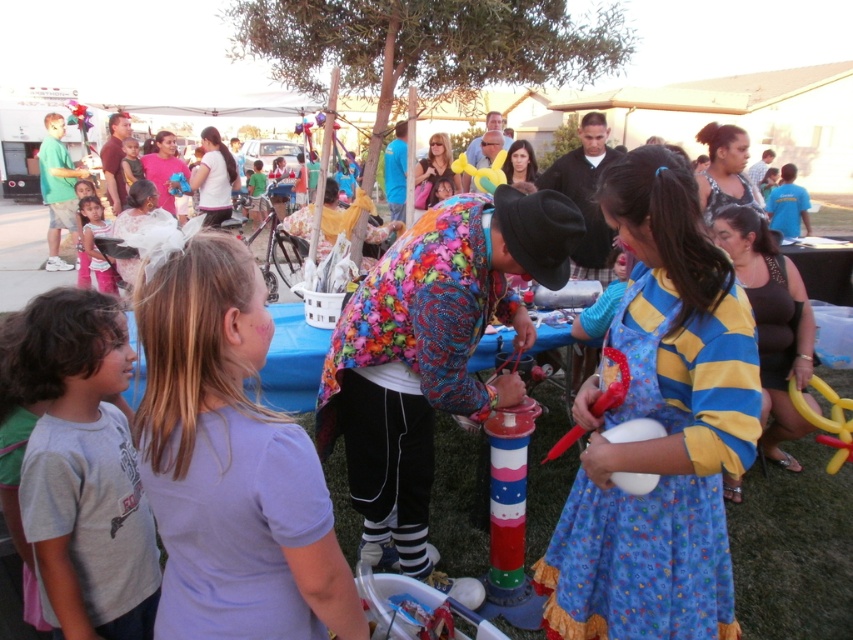
Does white matte balloon at lower center appear on the right side of matte pink dress at lower left?

Indeed, white matte balloon at lower center is positioned on the right side of matte pink dress at lower left.

How far apart are white matte balloon at lower center and matte pink dress at lower left?

white matte balloon at lower center is 5.60 meters from matte pink dress at lower left.

This screenshot has height=640, width=853. Find the location of `white matte balloon at lower center`. white matte balloon at lower center is located at coordinates (634, 429).

Is point (770, 371) positioned in front of point (451, 163)?

Yes.

Who is taller, black jersey dress at center or yellow balloon at center?

Standing taller between the two is yellow balloon at center.

Is point (759, 296) more distant than point (453, 170)?

No, it is not.

I want to click on black jersey dress at center, so click(775, 323).

Between yellow rubber balloon animal at lower right and white matte balloon at lower center, which one appears on the left side from the viewer's perspective?

white matte balloon at lower center

Does yellow rubber balloon animal at lower right lie in front of white matte balloon at lower center?

No, yellow rubber balloon animal at lower right is behind white matte balloon at lower center.

The image size is (853, 640). Describe the element at coordinates (827, 419) in the screenshot. I see `yellow rubber balloon animal at lower right` at that location.

Where is `yellow rubber balloon animal at lower right`? Image resolution: width=853 pixels, height=640 pixels. yellow rubber balloon animal at lower right is located at coordinates (827, 419).